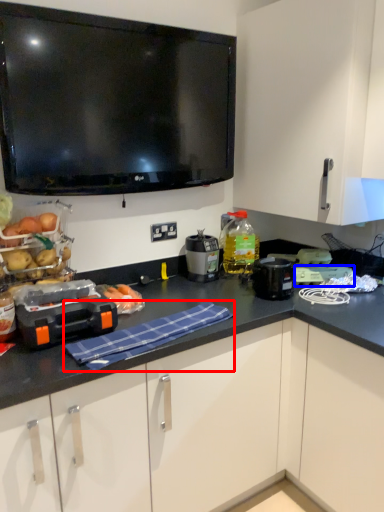
Question: Which point is closer to the camera, cloth (highlighted by a red box) or appliance (highlighted by a blue box)?

Choices:
 (A) cloth
 (B) appliance

Answer: (A)